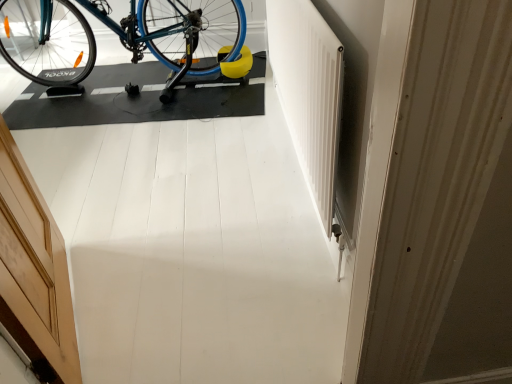
Question: In terms of height, does blue metallic bicycle at upper left look taller or shorter compared to wooden door at left?

Choices:
 (A) short
 (B) tall

Answer: (A)

Question: Which is correct: blue metallic bicycle at upper left is inside wooden door at left, or outside of it?

Choices:
 (A) outside
 (B) inside

Answer: (A)

Question: Looking at their shapes, would you say blue metallic bicycle at upper left is wider or thinner than wooden door at left?

Choices:
 (A) wide
 (B) thin

Answer: (A)

Question: Considering the relative positions of wooden door at left and blue metallic bicycle at upper left in the image provided, is wooden door at left to the left or to the right of blue metallic bicycle at upper left?

Choices:
 (A) left
 (B) right

Answer: (B)

Question: Is wooden door at left wider or thinner than blue metallic bicycle at upper left?

Choices:
 (A) wide
 (B) thin

Answer: (B)

Question: Is wooden door at left spatially inside blue metallic bicycle at upper left, or outside of it?

Choices:
 (A) inside
 (B) outside

Answer: (B)

Question: Based on their sizes in the image, would you say wooden door at left is bigger or smaller than blue metallic bicycle at upper left?

Choices:
 (A) big
 (B) small

Answer: (B)